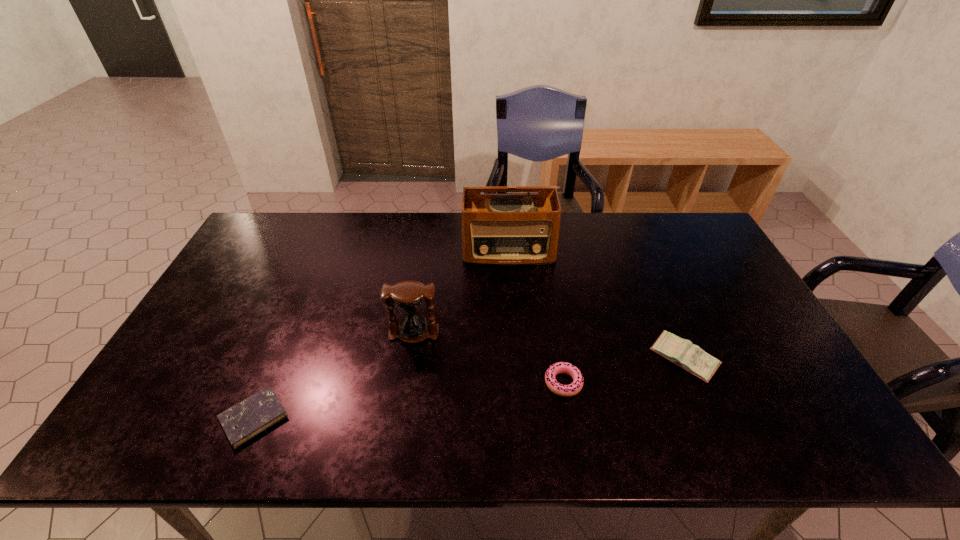
Identify the location of vacant space situated on the back of the second tallest object. This screenshot has width=960, height=540. (421, 281).

I want to click on blank area located on the back of the rightmost object, so click(x=652, y=284).

Where is `vacant point located on the left of the doughnut`? This screenshot has height=540, width=960. vacant point located on the left of the doughnut is located at coordinates (476, 383).

At what (x,y) coordinates should I click in order to perform the action: click on vacant space located 0.120m on the back of the left diary. Please return your answer as a coordinate pair (x, y). Looking at the image, I should click on (282, 350).

Image resolution: width=960 pixels, height=540 pixels. I want to click on object that is at the far edge, so click(497, 229).

You are a GUI agent. You are given a task and a screenshot of the screen. Output one action in this format:
    pyautogui.click(x=<x>, y=<y>)
    Task: Click on the object present at the near edge
    Image resolution: width=960 pixels, height=540 pixels.
    Given the screenshot: What is the action you would take?
    (243, 421)

Find the location of `vacant region at the far edge`. vacant region at the far edge is located at coordinates (579, 252).

Find the location of a particular element. This screenshot has height=540, width=960. free space at the near edge of the desktop is located at coordinates (303, 425).

Where is `free region at the left edge`? The height and width of the screenshot is (540, 960). free region at the left edge is located at coordinates (184, 358).

In the image, there is a desktop. What are the coordinates of `vacant space at the right edge` in the screenshot? It's located at (708, 264).